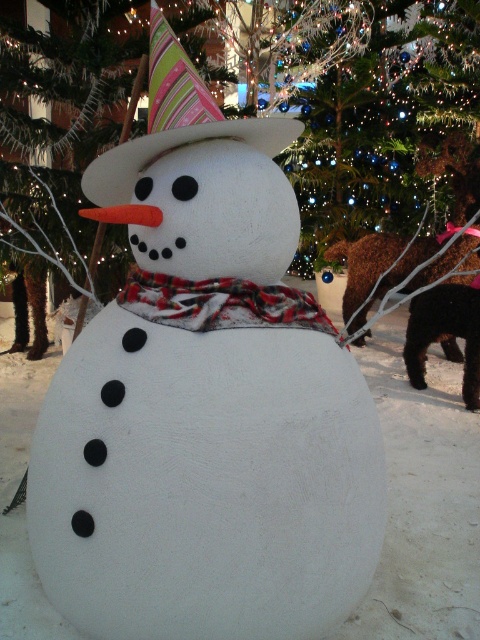
You are a photographer trying to capture the festive snowman. You want to ensure both the striped fabric party hat at upper center and the plaid fabric scarf at center are clearly visible in your photo. Which object should you focus on first to ensure it doesn t get cropped out?

The striped fabric party hat at upper center should be focused on first because it has a greater height compared to the plaid fabric scarf at center, making it more prominent and ensuring it stays within the frame.

You are standing at the origin point in the snowy scene. The white matte snowman at center is at coordinates 0.780, 0.881. If you want to walk directly to the snowman, which direction should you head?

The white matte snowman at center is located at coordinates [422,499], so you should head northeast to reach it.

You are planning to decorate a snowman for a winter festival. You have a striped fabric party hat at upper center and a plaid fabric scarf at center. Which item has a greater width?

The striped fabric party hat at upper center has a greater width than the plaid fabric scarf at center.